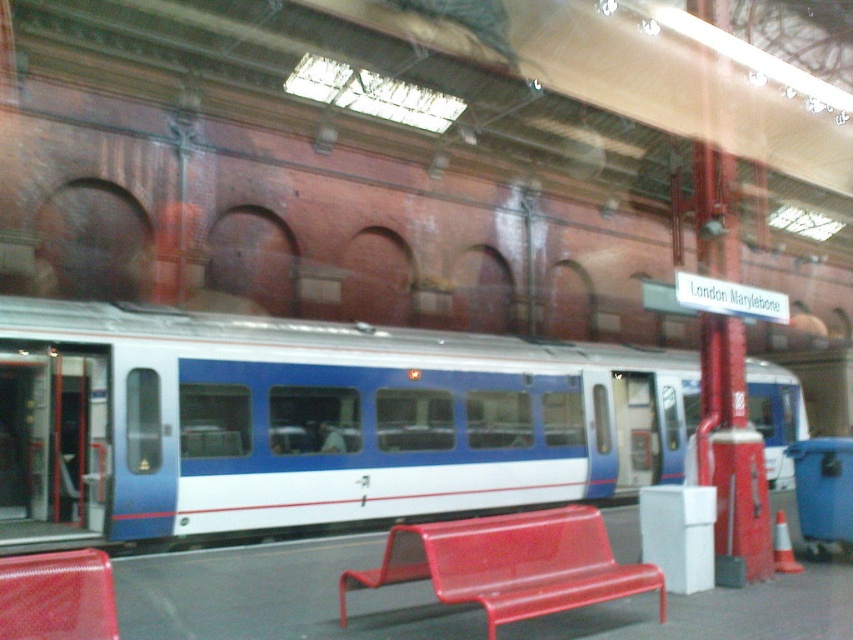
Question: Can you confirm if blue/white plastic train at center is smaller than metallic red bench at lower center?

Choices:
 (A) yes
 (B) no

Answer: (B)

Question: Which object is positioned closest to the rubberized red bench at lower left?

Choices:
 (A) metallic red bench at lower center
 (B) blue/white plastic train at center

Answer: (A)

Question: Which object is the closest to the metallic red bench at lower center?

Choices:
 (A) blue/white plastic train at center
 (B) rubberized red bench at lower left

Answer: (B)

Question: Which object is the closest to the metallic red bench at lower center?

Choices:
 (A) blue/white plastic train at center
 (B) rubberized red bench at lower left

Answer: (B)

Question: Does blue/white plastic train at center come behind metallic red bench at lower center?

Choices:
 (A) no
 (B) yes

Answer: (B)

Question: Does metallic red bench at lower center appear on the left side of rubberized red bench at lower left?

Choices:
 (A) no
 (B) yes

Answer: (A)